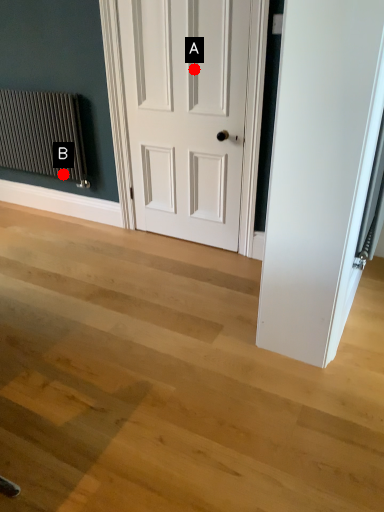
Question: Two points are circled on the image, labeled by A and B beside each circle. Which point is closer to the camera taking this photo?

Choices:
 (A) A is closer
 (B) B is closer

Answer: (A)